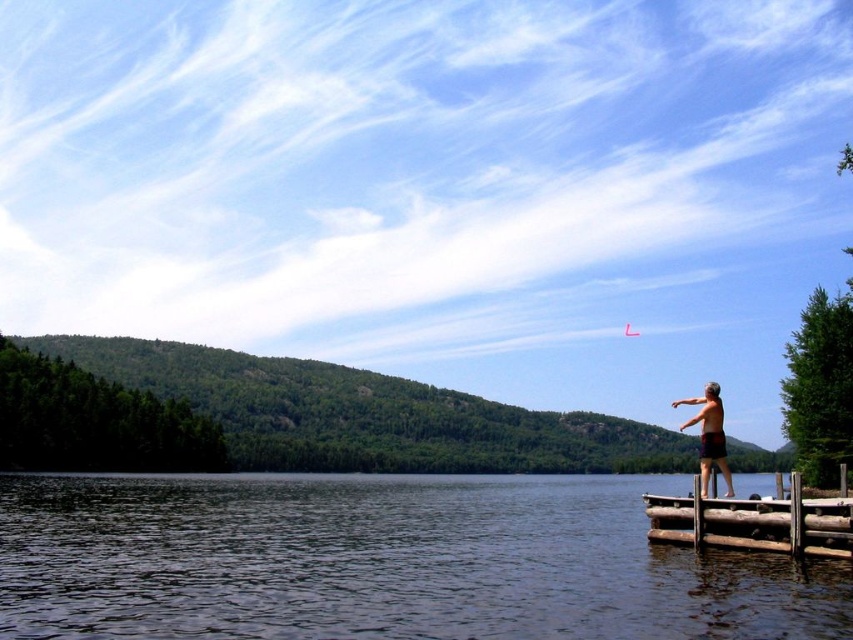
Does dark green water at lower left have a smaller size compared to brown wooden dock at lower right?

Actually, dark green water at lower left might be larger than brown wooden dock at lower right.

At what (x,y) coordinates should I click in order to perform the action: click on dark green water at lower left. Please return your answer as a coordinate pair (x, y). The image size is (853, 640). Looking at the image, I should click on (381, 561).

Which is behind, point (183, 538) or point (683, 422)?

Positioned behind is point (183, 538).

Does dark green water at lower left have a larger size compared to skinny man at right?

Correct, dark green water at lower left is larger in size than skinny man at right.

This screenshot has height=640, width=853. I want to click on dark green water at lower left, so click(x=381, y=561).

At what (x,y) coordinates should I click in order to perform the action: click on dark green water at lower left. Please return your answer as a coordinate pair (x, y). Image resolution: width=853 pixels, height=640 pixels. Looking at the image, I should click on (381, 561).

In the scene shown: Can you confirm if brown wooden dock at lower right is thinner than red paper kite at upper center?

In fact, brown wooden dock at lower right might be wider than red paper kite at upper center.

Does brown wooden dock at lower right have a larger size compared to red paper kite at upper center?

Yes, brown wooden dock at lower right is bigger than red paper kite at upper center.

The height and width of the screenshot is (640, 853). I want to click on brown wooden dock at lower right, so click(753, 522).